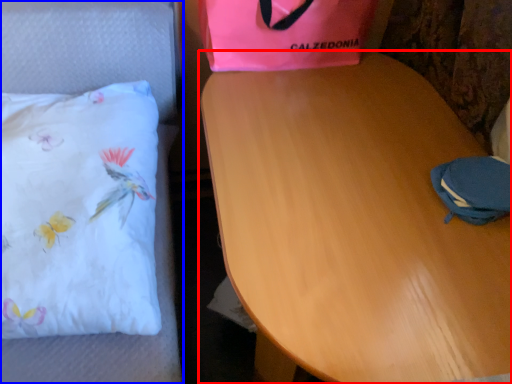
Question: Which of the following is the closest to the observer, table (highlighted by a red box) or furniture (highlighted by a blue box)?

Choices:
 (A) table
 (B) furniture

Answer: (A)